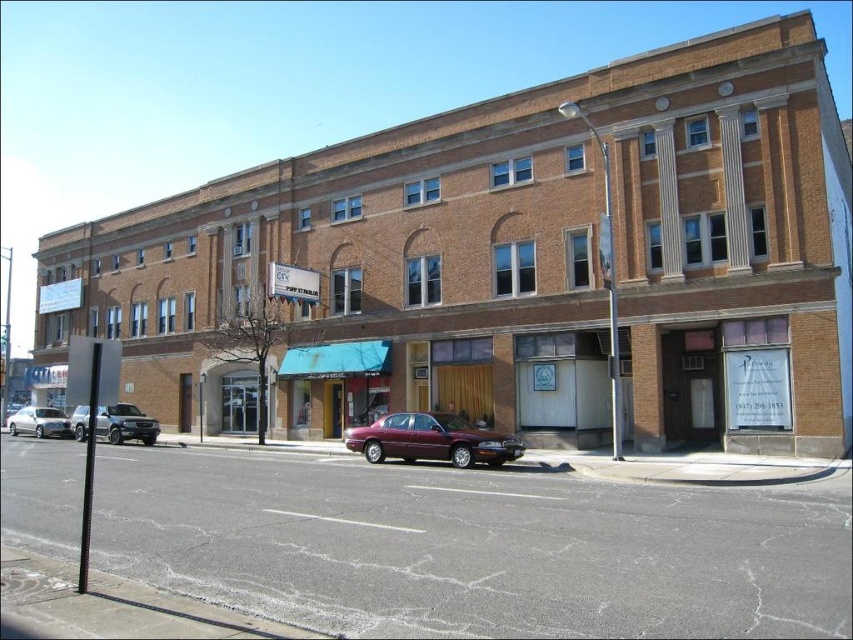
You are a delivery person trying to park your vehicle in the parking spot near the building. There are two vehicles in the way. The satin silver suv at left and the silver metallic sedan at left. Which vehicle is blocking your path more directly?

The satin silver suv at left is positioned over the silver metallic sedan at left, so it is blocking the path more directly.

You are standing on the sidewalk in front of the building and want to cross the street to the other side. There are two vehicles in your path. Which vehicle is closer to you, the maroon metallic sedan at center or the satin silver suv at left?

The maroon metallic sedan at center is closer to you since it is positioned below the satin silver suv at left, indicating it is nearer in the street.